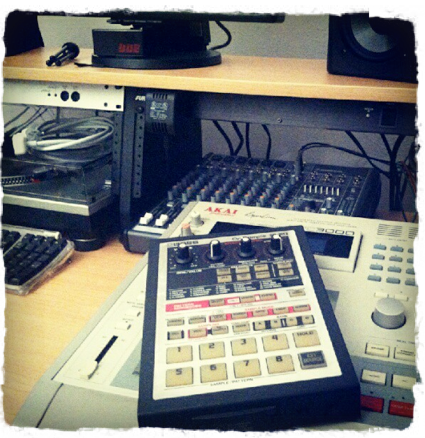
Find the location of a particular element. This screenshot has height=438, width=425. wooden shelf is located at coordinates (259, 72).